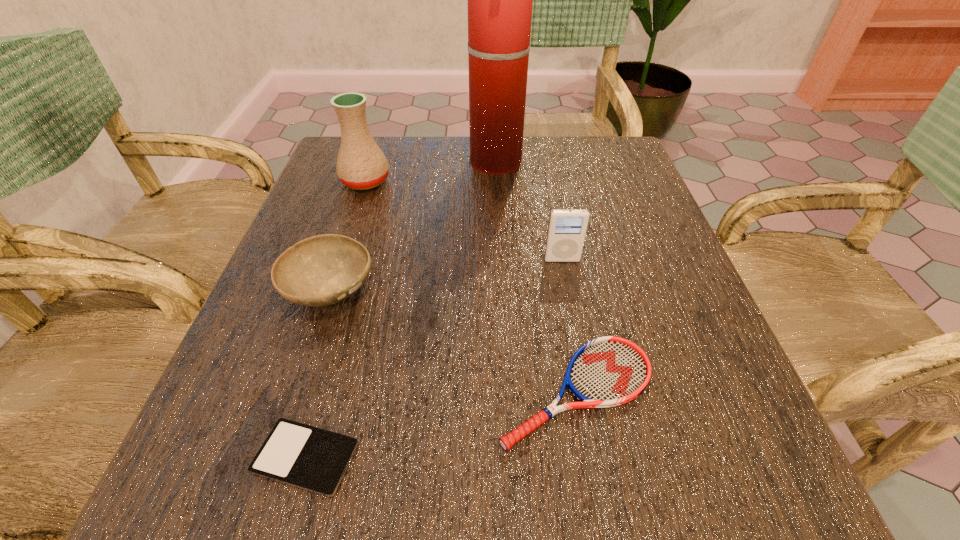
Locate an element on the screen. The height and width of the screenshot is (540, 960). the tallest object is located at coordinates (500, 0).

The width and height of the screenshot is (960, 540). In order to click on pottery in this screenshot , I will do (361, 165).

Identify the location of the right iPod. tap(567, 228).

In order to click on the fourth shortest object in this screenshot , I will do `click(567, 228)`.

Locate an element on the screen. Image resolution: width=960 pixels, height=540 pixels. bowl is located at coordinates (322, 270).

In order to click on the fifth tallest object in this screenshot , I will do `click(608, 371)`.

The width and height of the screenshot is (960, 540). Find the location of `the nearer iPod`. the nearer iPod is located at coordinates pos(306,457).

Identify the location of the left iPod. The height and width of the screenshot is (540, 960). (306, 457).

Where is `free point located 0.070m with the nozzle and gauge on the fire extinguisher`? free point located 0.070m with the nozzle and gauge on the fire extinguisher is located at coordinates (441, 163).

Image resolution: width=960 pixels, height=540 pixels. I want to click on free space located with the nozzle and gauge on the fire extinguisher, so click(x=391, y=163).